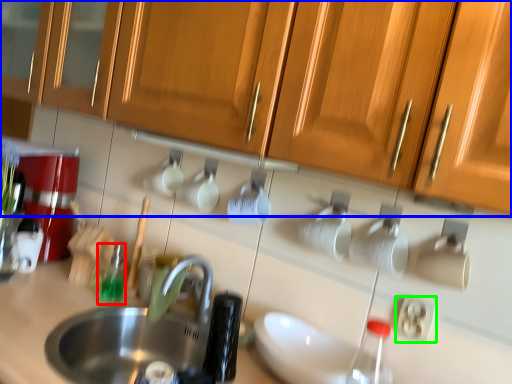
Question: Considering the real-world distances, which object is farthest from bottle (highlighted by a red box)? cabinetry (highlighted by a blue box) or electric outlet (highlighted by a green box)?

Choices:
 (A) cabinetry
 (B) electric outlet

Answer: (B)